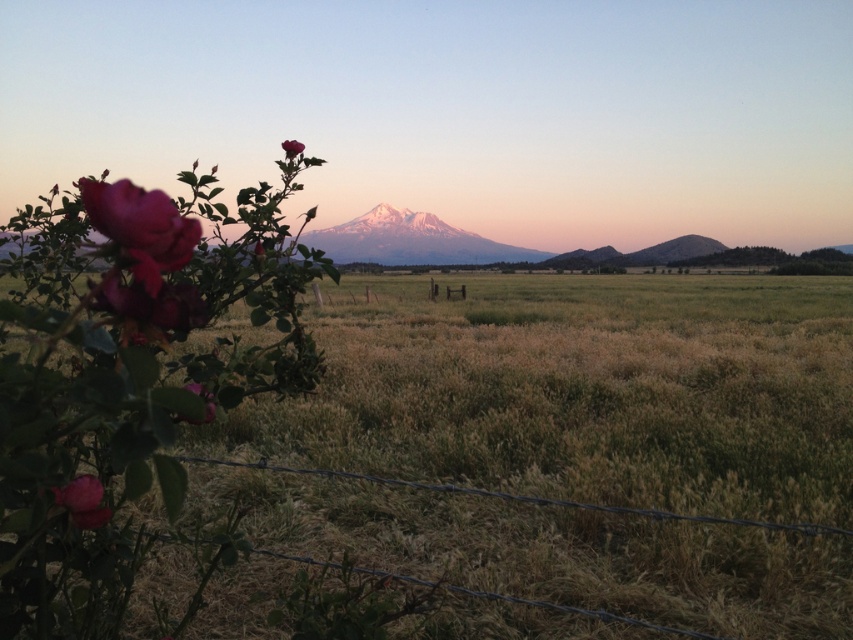
You are standing at the point marked by the coordinates point (578, 392). What is the name of the area you are currently in?

The point (578, 392) marks grassy field at center.

You are a photographer standing at the edge of the grassy field at center. You want to capture a photo of the matte pink rose at upper center without including the barbed wire fence in the background. Given the distance between them, can you position yourself in such a way that the fence is out of the frame?

The distance between the grassy field at center and the matte pink rose at upper center is 39.57 feet. Since the fence is part of the middle ground and the rose is at upper center, positioning yourself closer to the rose while keeping the fence behind the grassy field might allow you to exclude the fence from the frame. However, the exact feasibility depends on the camera angle and lens used.